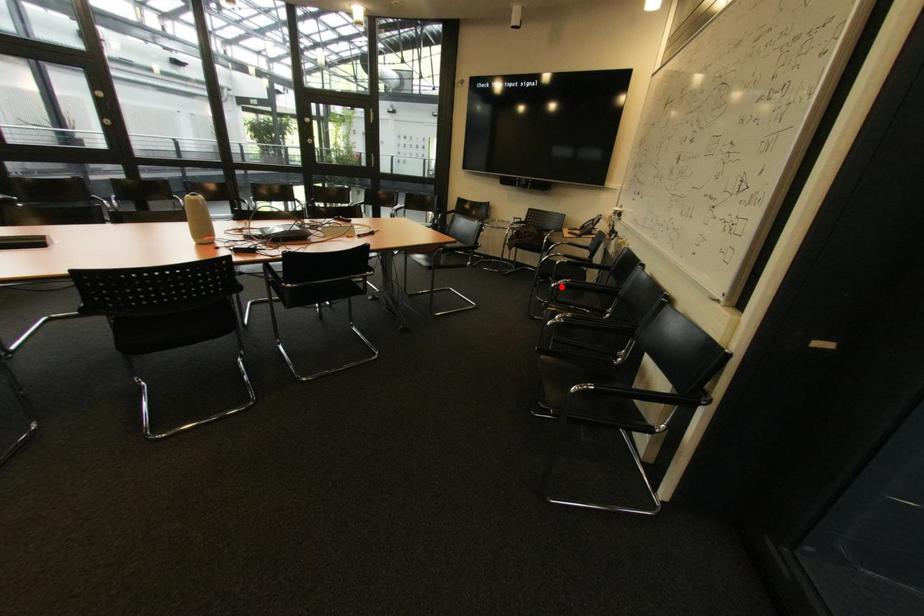
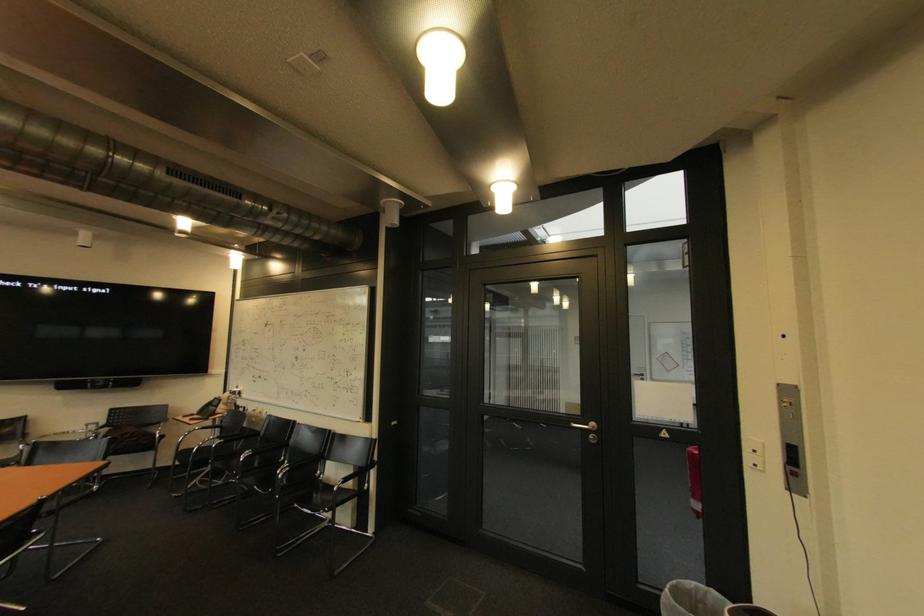
Locate, in the second image, the point that corresponds to the highlighted location in the first image.

(250, 460)